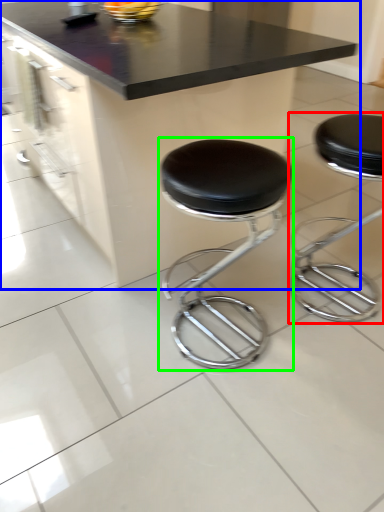
Question: Based on their relative distances, which object is nearer to stool (highlighted by a red box)? Choose from table (highlighted by a blue box) and stool (highlighted by a green box).

Choices:
 (A) table
 (B) stool

Answer: (B)